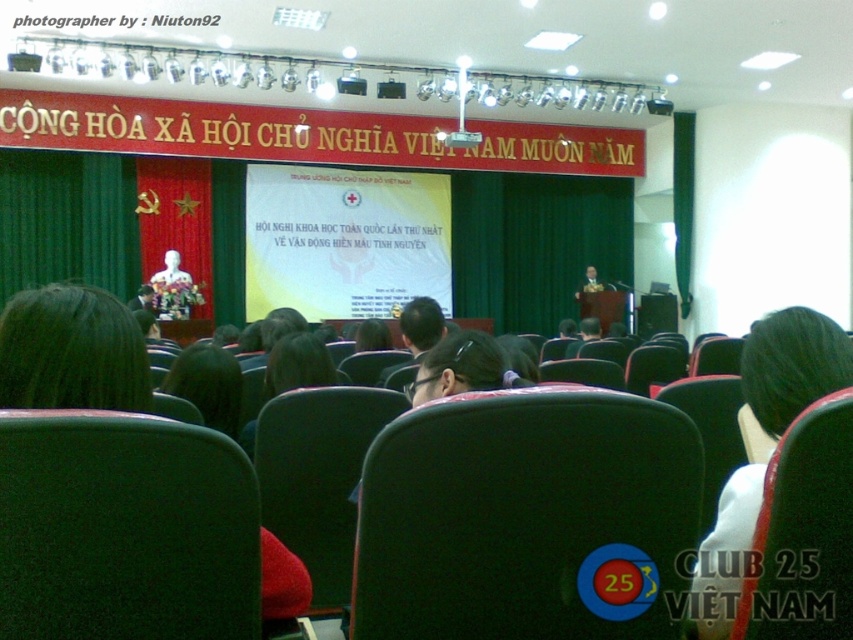
You are organizing a meeting and need to seat two people of different sizes. The smaller person prefers a narrower seat. Which chair should they choose between the green fabric chair at lower left and the green fabric chair at center?

The green fabric chair at lower left has a smaller width compared to the green fabric chair at center, so the smaller person should choose the green fabric chair at lower left.